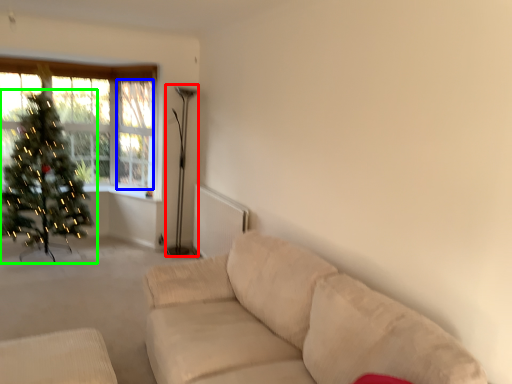
Question: Which object is positioned farthest from lamp (highlighted by a red box)? Select from window screen (highlighted by a blue box) and christmas tree (highlighted by a green box).

Choices:
 (A) window screen
 (B) christmas tree

Answer: (B)